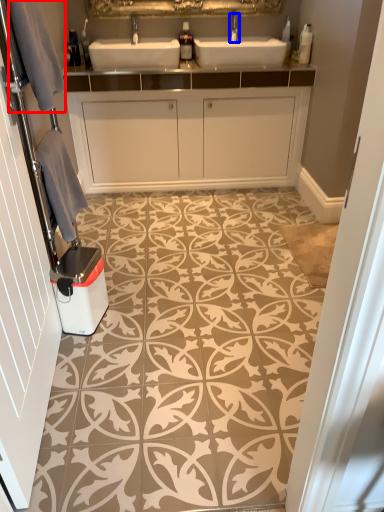
Question: Which point is further to the camera, gray (highlighted by a red box) or tap (highlighted by a blue box)?

Choices:
 (A) gray
 (B) tap

Answer: (B)